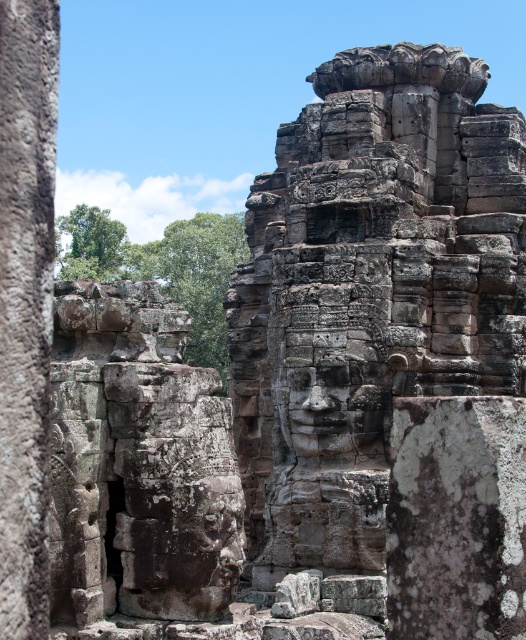
Question: Is weathered stone face at center smaller than rough stone carving at left?

Choices:
 (A) yes
 (B) no

Answer: (B)

Question: Is weathered stone face at center behind rough stone carving at left?

Choices:
 (A) yes
 (B) no

Answer: (A)

Question: Which point is farther to the camera?

Choices:
 (A) (366, 406)
 (B) (5, 531)
 (C) (274, 502)

Answer: (C)

Question: Estimate the real-world distances between objects in this image. Which object is closer to the rough stone face at center?

Choices:
 (A) rough stone carving at left
 (B) weathered stone face at center

Answer: (B)

Question: Does weathered stone face at center appear under rough stone carving at left?

Choices:
 (A) no
 (B) yes

Answer: (B)

Question: Which object is the farthest from the weathered stone face at center?

Choices:
 (A) rough stone face at center
 (B) rough stone carving at left

Answer: (B)